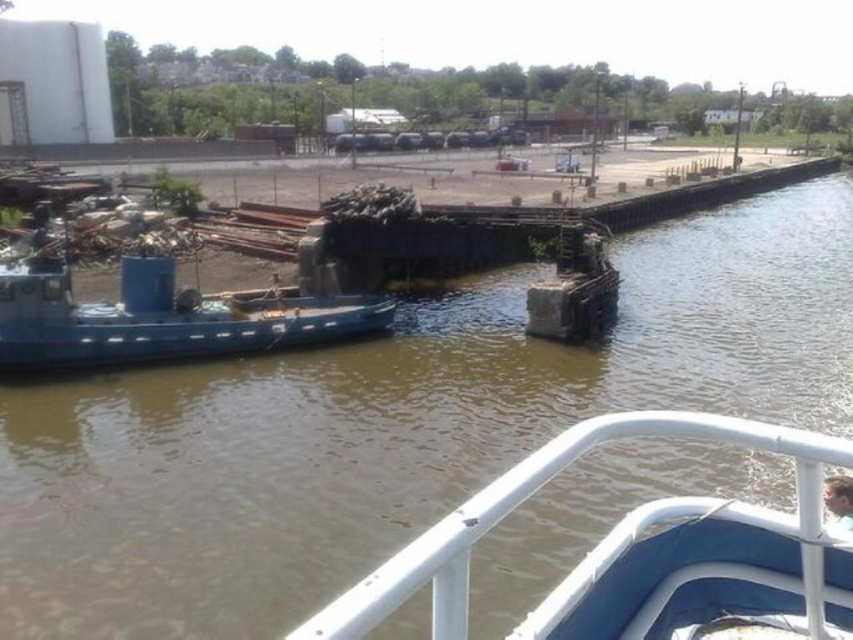
Who is higher up, blue matte boat at left or smooth skin face at lower right?

blue matte boat at left is higher up.

Does blue matte boat at left appear on the left side of smooth skin face at lower right?

Indeed, blue matte boat at left is positioned on the left side of smooth skin face at lower right.

Does point (96, 307) come behind point (842, 518)?

Yes.

Where is `blue matte boat at left`? The image size is (853, 640). blue matte boat at left is located at coordinates (161, 317).

In order to click on white matte rail at lower center in this screenshot , I will do `click(641, 554)`.

Between point (834, 444) and point (851, 481), which one is positioned behind?

Positioned behind is point (851, 481).

Find the location of a particular element. white matte rail at lower center is located at coordinates (641, 554).

Between white matte rail at lower center and blue matte boat at left, which one appears on the left side from the viewer's perspective?

From the viewer's perspective, blue matte boat at left appears more on the left side.

Consider the image. Does white matte rail at lower center appear under blue matte boat at left?

Correct, white matte rail at lower center is located below blue matte boat at left.

Who is more distant from viewer, (358, 595) or (26, 328)?

Positioned behind is point (26, 328).

Locate an element on the screen. The height and width of the screenshot is (640, 853). white matte rail at lower center is located at coordinates (641, 554).